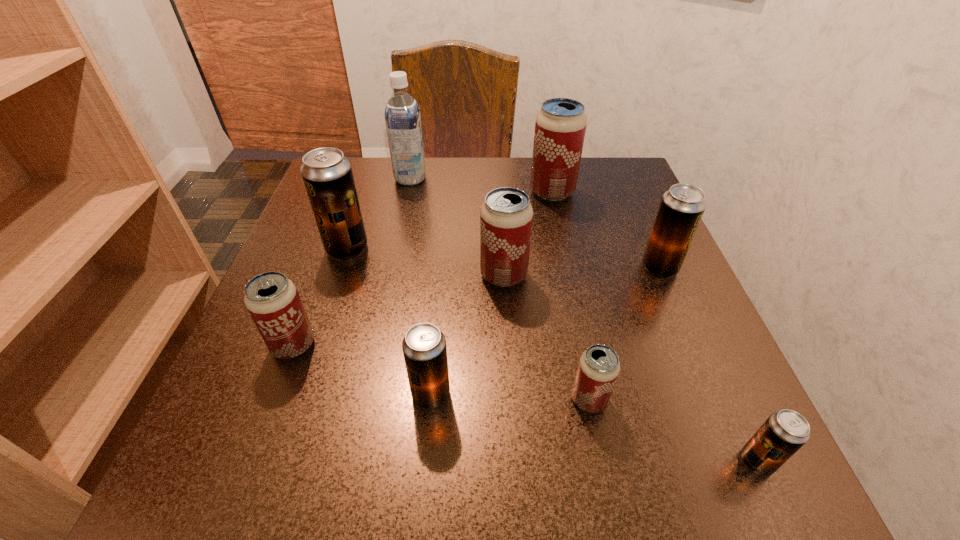
Find the location of a particular element. vacant region located on the back of the sixth object from right to left is located at coordinates (439, 307).

Identify the location of blank space located 0.370m on the right of the sixth farthest object. (551, 345).

At what (x,y) coordinates should I click in order to perform the action: click on free space located on the left of the smallest red beer can. Please return your answer as a coordinate pair (x, y). Looking at the image, I should click on (394, 400).

Where is `free space located on the back of the smallest black beer can`? The height and width of the screenshot is (540, 960). free space located on the back of the smallest black beer can is located at coordinates (693, 322).

Identify the location of soya milk present at the far edge. (402, 114).

I want to click on beer can located in the far edge section of the desktop, so click(x=560, y=126).

Locate an element on the screen. The image size is (960, 540). object present at the near edge is located at coordinates (785, 431).

This screenshot has height=540, width=960. In order to click on object that is positioned at the far right corner in this screenshot , I will do `click(560, 126)`.

This screenshot has width=960, height=540. I want to click on object situated at the near right corner, so pyautogui.click(x=785, y=431).

Find the location of a particular element. The width and height of the screenshot is (960, 540). vacant space at the far edge is located at coordinates (414, 206).